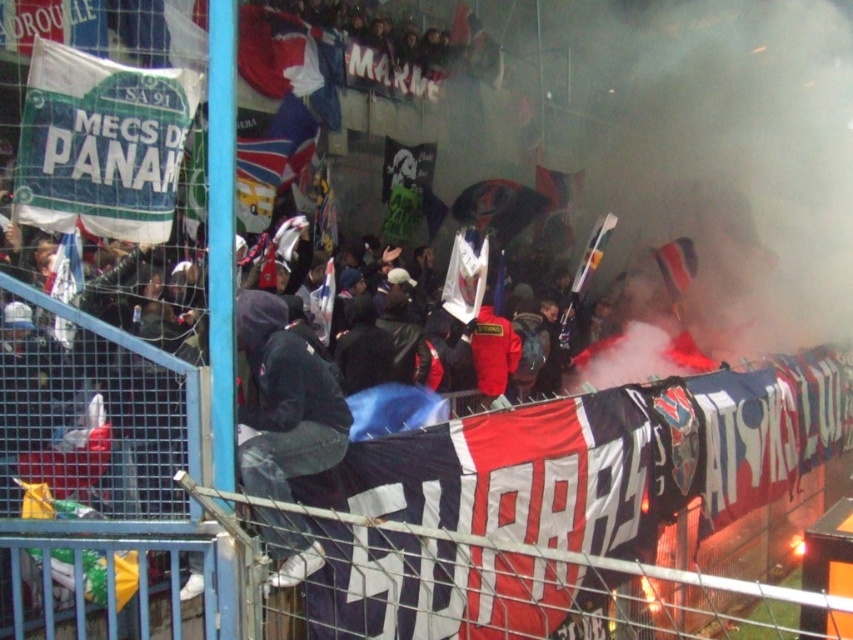
Is red and white fabric banner at center positioned before white fabric flag at left?

Yes, it is in front of white fabric flag at left.

Which is behind, point (538, 508) or point (73, 244)?

The point (538, 508) is more distant.

Where is `red and white fabric banner at center`? The height and width of the screenshot is (640, 853). red and white fabric banner at center is located at coordinates (514, 476).

Is point (370, 634) closer to viewer compared to point (482, 266)?

Yes.

The height and width of the screenshot is (640, 853). I want to click on red and white fabric banner at center, so click(x=514, y=476).

At what (x,y) coordinates should I click in order to perform the action: click on red and white fabric banner at center. Please return your answer as a coordinate pair (x, y). Looking at the image, I should click on (514, 476).

Does white paper flag at center appear over white fabric flag at left?

Yes, white paper flag at center is above white fabric flag at left.

Is white paper flag at center wider than white fabric flag at left?

Correct, the width of white paper flag at center exceeds that of white fabric flag at left.

Which is behind, point (465, 317) or point (59, 337)?

The point (465, 317) is behind.

Identify the location of white paper flag at center. The image size is (853, 640). (465, 276).